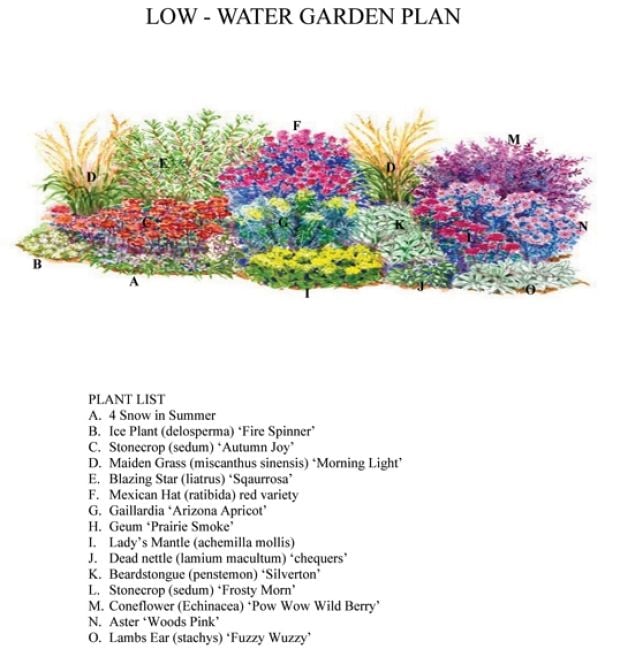
Find the location of a particular element. The width and height of the screenshot is (620, 649). plant is located at coordinates (144, 434).